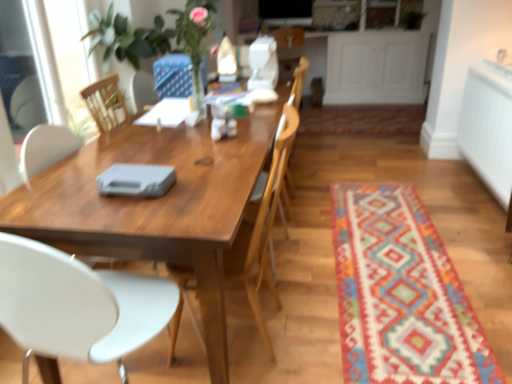
Where is `free point above multicolored woven mat at lower right, the first mat in the front-to-back sequence (from a real-world perspective)`? The width and height of the screenshot is (512, 384). free point above multicolored woven mat at lower right, the first mat in the front-to-back sequence (from a real-world perspective) is located at coordinates (398, 269).